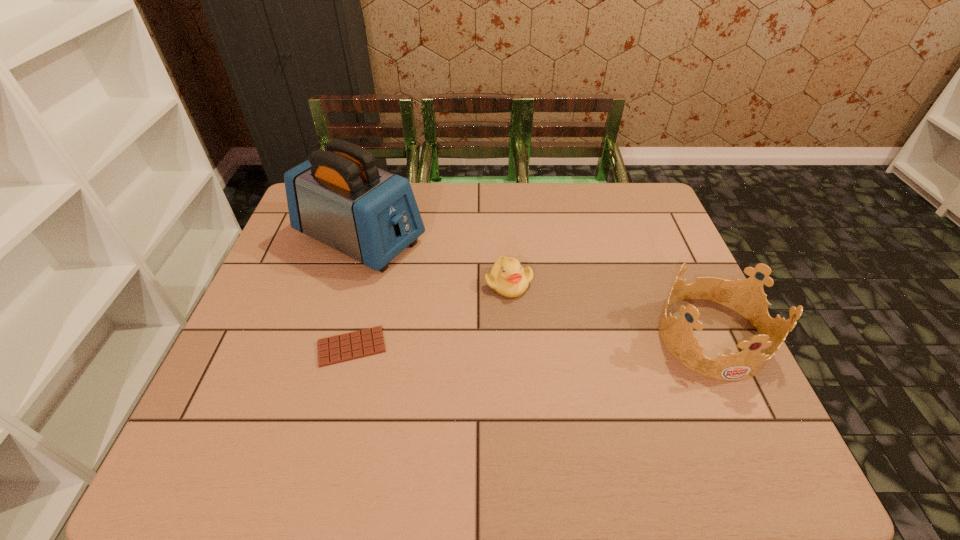
Identify the location of vacant space at the left edge of the desktop. The image size is (960, 540). (257, 304).

Image resolution: width=960 pixels, height=540 pixels. In the image, there is a desktop. Identify the location of vacant space at the right edge. (647, 240).

At what (x,y) coordinates should I click in order to perform the action: click on free location at the far right corner of the desktop. Please return your answer as a coordinate pair (x, y). This screenshot has width=960, height=540. Looking at the image, I should click on (653, 202).

I want to click on vacant area that lies between the candy bar and the toaster, so click(x=356, y=293).

Where is `empty space between the tiara and the third tallest object`? empty space between the tiara and the third tallest object is located at coordinates (610, 309).

The height and width of the screenshot is (540, 960). In order to click on vacant area that lies between the tallest object and the candy bar in this screenshot , I will do `click(356, 293)`.

Locate an element on the screen. This screenshot has height=540, width=960. free space that is in between the candy bar and the tallest object is located at coordinates (356, 293).

Find the location of a particular element. This screenshot has width=960, height=540. free spot between the shortest object and the second tallest object is located at coordinates (531, 341).

Where is `free space between the toaster and the duckling`? free space between the toaster and the duckling is located at coordinates (435, 261).

Identify the location of empty space between the second tallest object and the third tallest object. This screenshot has width=960, height=540. (610, 309).